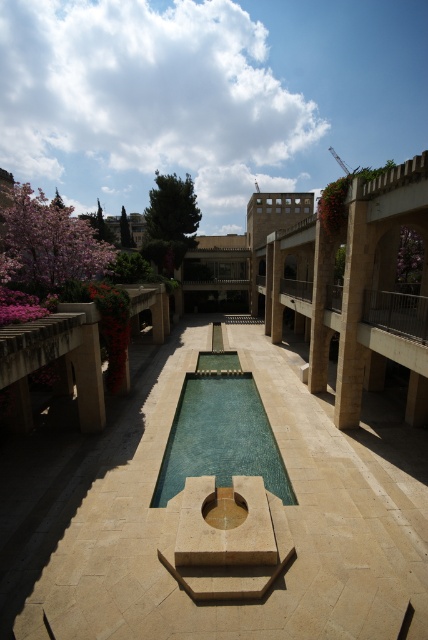
Question: Where is smooth stone fountain at center located in relation to green glass swimming pool at center in the image?

Choices:
 (A) right
 (B) left

Answer: (A)

Question: Which point is farther from the camera taking this photo?

Choices:
 (A) (314, 310)
 (B) (279, 305)
 (C) (196, 376)
 (D) (148, 387)

Answer: (B)

Question: Does smooth stone fountain at center appear on the right side of brown stone pillar at center?

Choices:
 (A) yes
 (B) no

Answer: (B)

Question: Which object is farther from the camera taking this photo?

Choices:
 (A) green glass swimming pool at center
 (B) brown stone pillar at center
 (C) beige stone pillar at center

Answer: (C)

Question: Which point is farther from the camera taking this photo?

Choices:
 (A) (186, 426)
 (B) (318, 372)

Answer: (B)

Question: Is smooth stone fountain at center above green glass swimming pool at center?

Choices:
 (A) yes
 (B) no

Answer: (B)